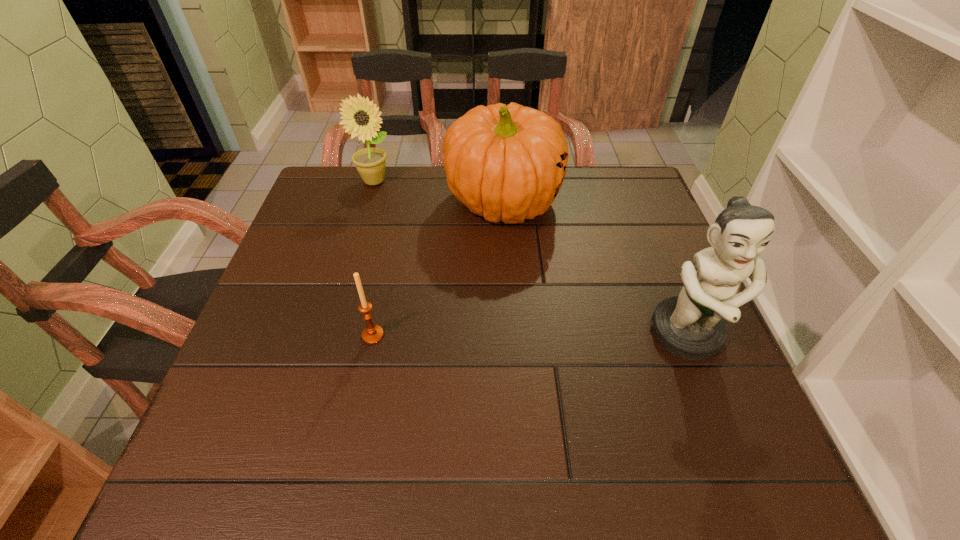
You are a GUI agent. You are given a task and a screenshot of the screen. Output one action in this format:
    pyautogui.click(x=<x>, y=<y>)
    Task: Click on the shortest object
    This screenshot has width=960, height=540.
    Given the screenshot: What is the action you would take?
    pyautogui.click(x=371, y=334)

Find the location of a particular element. candle_holder is located at coordinates (371, 334).

Locate an element on the screen. This screenshot has height=540, width=960. the rightmost object is located at coordinates (691, 326).

At what (x,y) coordinates should I click in order to perform the action: click on pumpkin. Please return your answer as a coordinate pair (x, y). The image size is (960, 540). Looking at the image, I should click on (505, 162).

Locate an element on the screen. The height and width of the screenshot is (540, 960). the leftmost object is located at coordinates (361, 117).

At what (x,y) coordinates should I click in order to perform the action: click on vacant space located 0.130m on the left of the candle_holder. Please return your answer as a coordinate pair (x, y). Image resolution: width=960 pixels, height=540 pixels. Looking at the image, I should click on (299, 335).

Locate an element on the screen. The image size is (960, 540). free space located 0.090m on the front-facing side of the rightmost object is located at coordinates (719, 415).

Locate an element on the screen. This screenshot has height=540, width=960. free space located 0.300m on the surface of the third object from left to right is located at coordinates (573, 331).

Where is `free location located 0.210m on the surface of the third object from left to right`? This screenshot has height=540, width=960. free location located 0.210m on the surface of the third object from left to right is located at coordinates (556, 300).

Where is `vacant space located 0.050m on the surface of the third object from left to right`? vacant space located 0.050m on the surface of the third object from left to right is located at coordinates (530, 252).